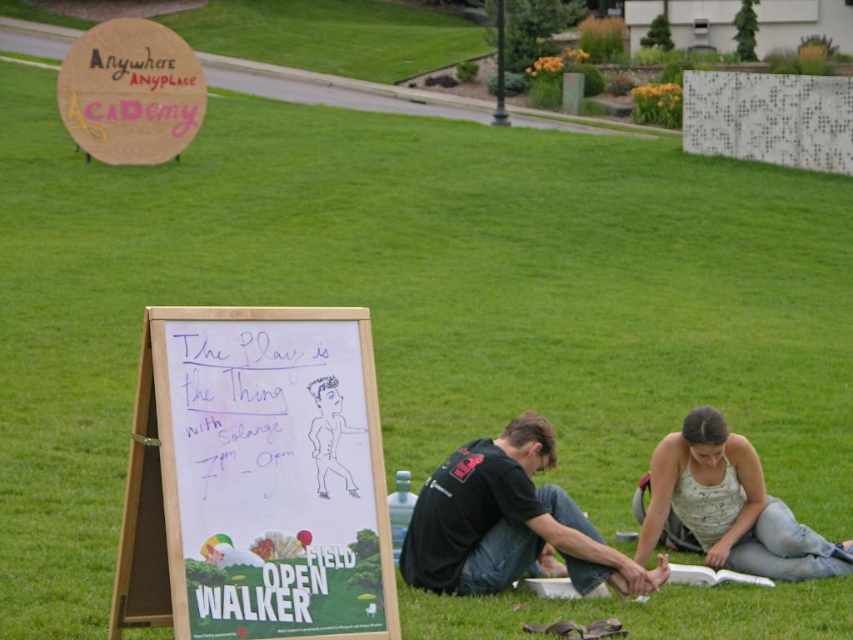
Is black matte t-shirt at lower center below white cotton tank top at lower right?

No, black matte t-shirt at lower center is not below white cotton tank top at lower right.

Which is below, black matte t-shirt at lower center or white cotton tank top at lower right?

Positioned lower is white cotton tank top at lower right.

This screenshot has width=853, height=640. Identify the location of black matte t-shirt at lower center. (508, 522).

Is white wood easel at center below black matte t-shirt at lower center?

Actually, white wood easel at center is above black matte t-shirt at lower center.

Is white wood easel at center to the right of black matte t-shirt at lower center from the viewer's perspective?

Incorrect, white wood easel at center is not on the right side of black matte t-shirt at lower center.

Between point (194, 388) and point (535, 541), which one is positioned in front?

Point (194, 388)

Locate an element on the screen. Image resolution: width=853 pixels, height=640 pixels. white wood easel at center is located at coordinates (254, 480).

Between white cotton tank top at lower right and wooden signboard at upper left, which one has less height?

white cotton tank top at lower right

Does white cotton tank top at lower right appear over wooden signboard at upper left?

No, white cotton tank top at lower right is not above wooden signboard at upper left.

What do you see at coordinates (726, 508) in the screenshot?
I see `white cotton tank top at lower right` at bounding box center [726, 508].

This screenshot has height=640, width=853. In order to click on white cotton tank top at lower right in this screenshot , I will do `click(726, 508)`.